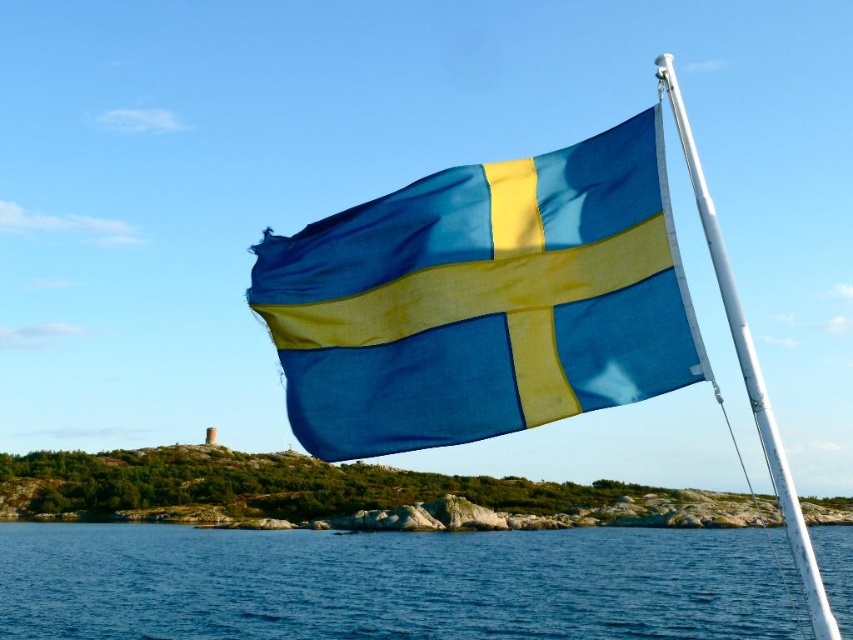
You are a photographer trying to capture the Swedish flag in the image. The flag has two objects associated with it. Which object is closer to you, the blue fabric flag at upper right or the white metallic pole at upper right?

The blue fabric flag at upper right is closer to you than the white metallic pole at upper right because it is positioned further to the viewer.